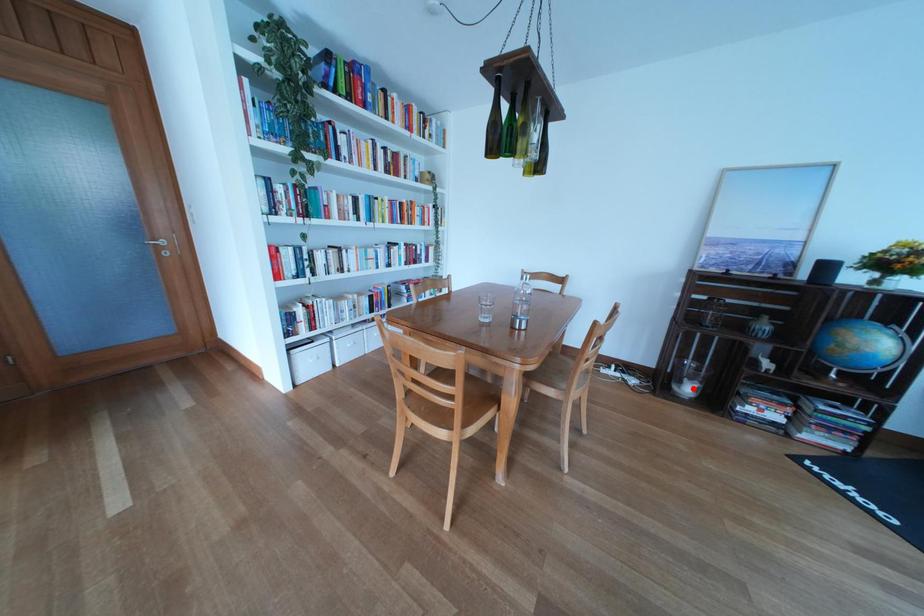
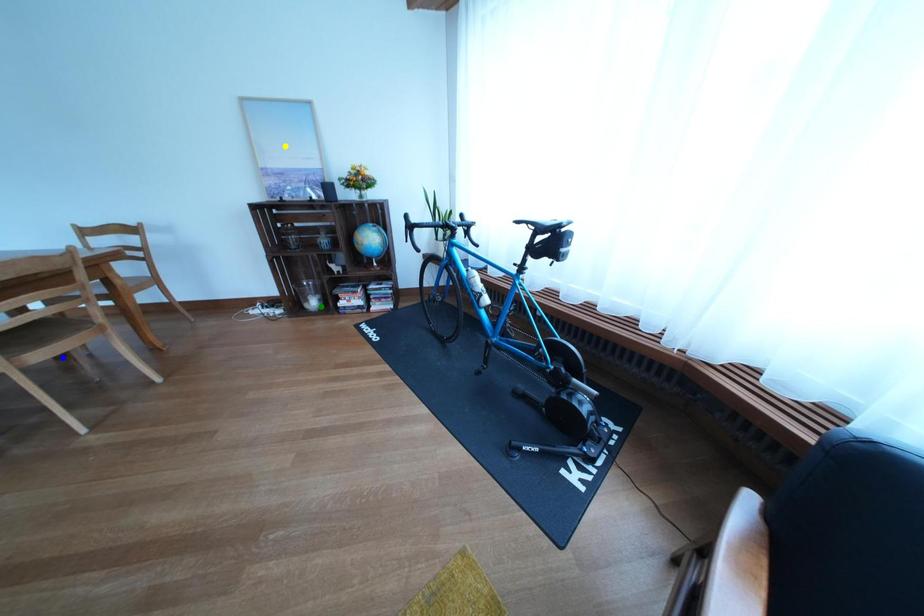
Question: I am providing you with two images of the same scene from different viewpoints. A red point is marked on the first image. You are given multiple points on the second image. Can you choose the point in image 2 that corresponds to the point in image 1?

Choices:
 (A) green point
 (B) blue point
 (C) yellow point

Answer: (A)